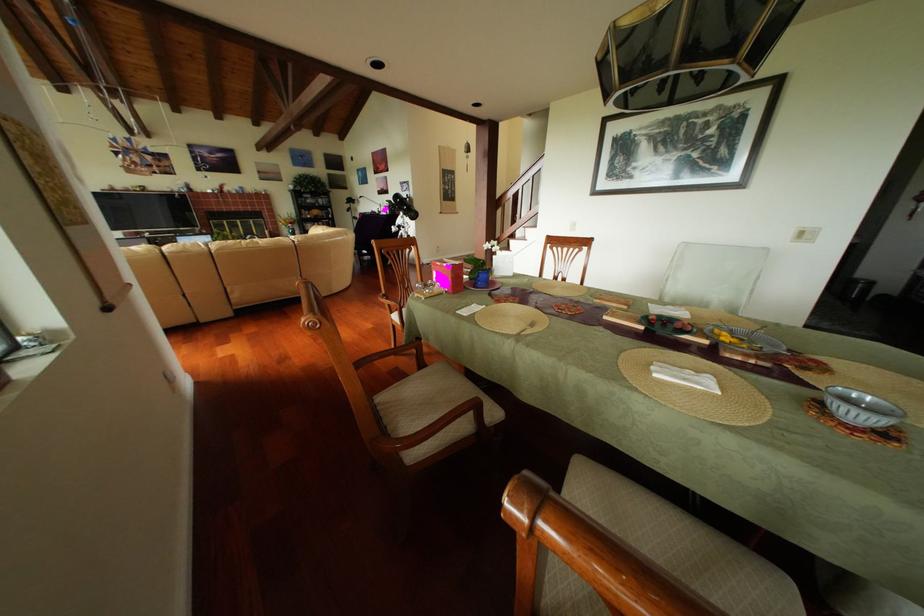
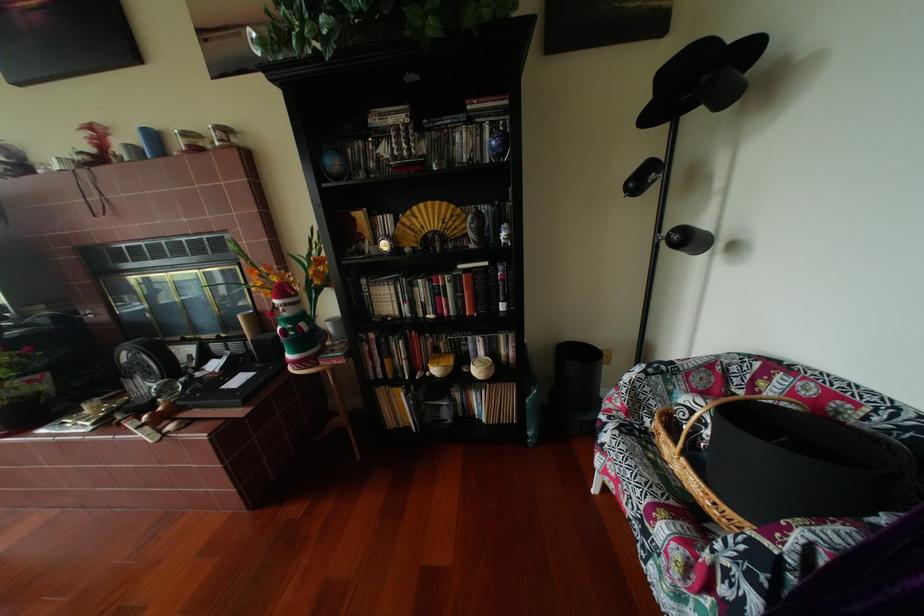
The point at (321, 213) is marked in the first image. Where is the corresponding point in the second image?

(402, 219)